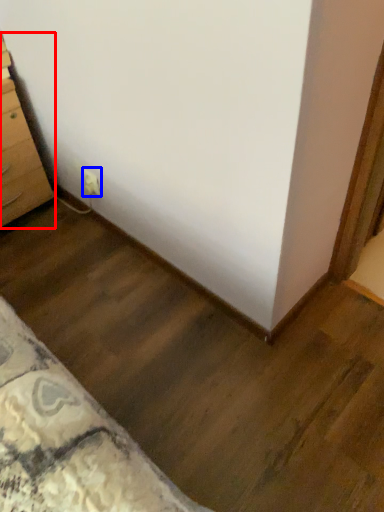
Question: Which of the following is the farthest to the observer, chest of drawers (highlighted by a red box) or electric outlet (highlighted by a blue box)?

Choices:
 (A) chest of drawers
 (B) electric outlet

Answer: (B)